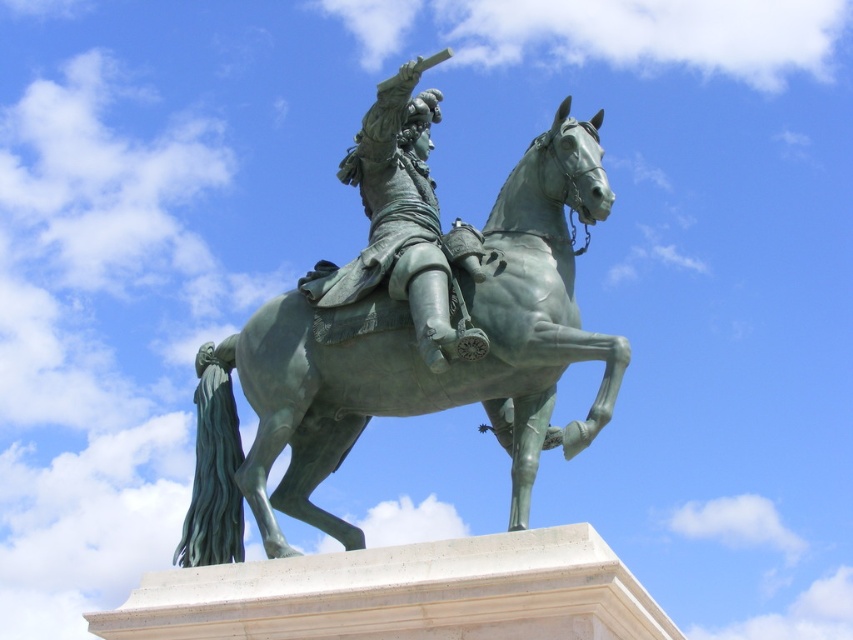
Is green polished bronze statue at center bigger than green polished metal horse at center?

No, green polished bronze statue at center is not bigger than green polished metal horse at center.

Does green polished bronze statue at center appear on the left side of green polished metal horse at center?

In fact, green polished bronze statue at center is to the right of green polished metal horse at center.

Locate an element on the screen. Image resolution: width=853 pixels, height=640 pixels. green polished bronze statue at center is located at coordinates (405, 358).

Locate an element on the screen. This screenshot has width=853, height=640. green polished bronze statue at center is located at coordinates (405, 358).